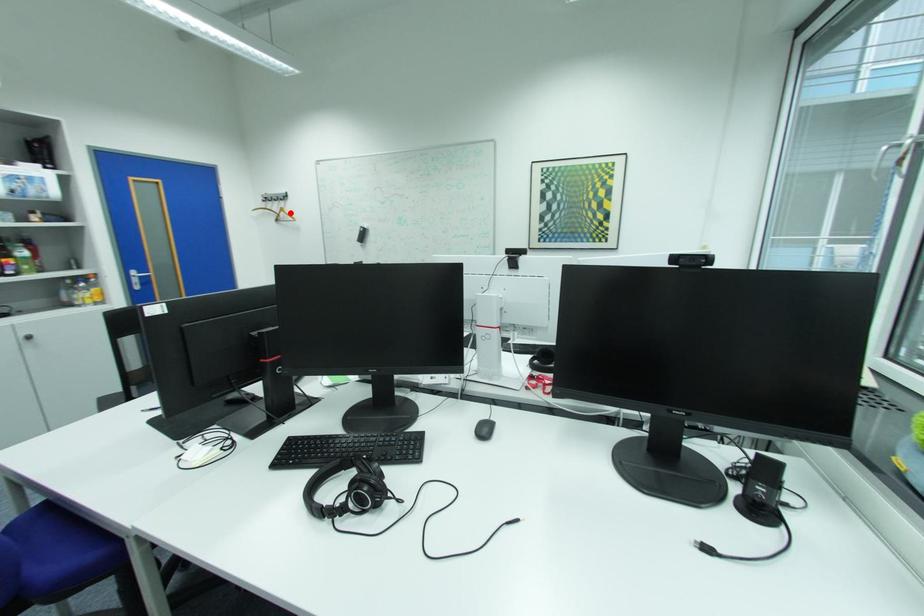
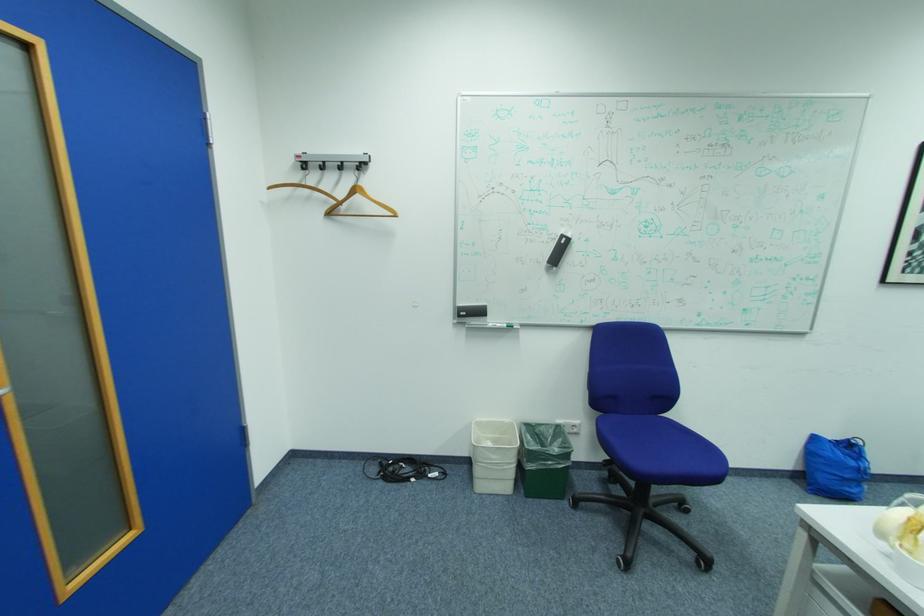
Where in the second image is the point corresponding to the highlighted location from the first image?

(366, 197)